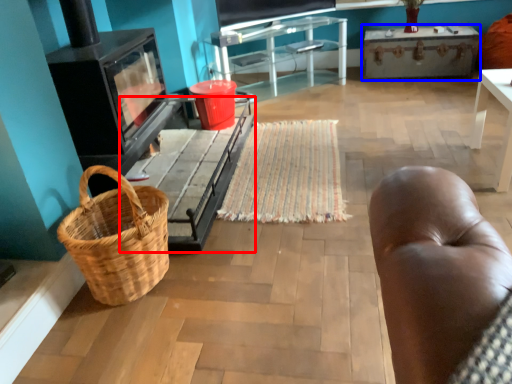
Question: Among these objects, which one is nearest to the camera, table (highlighted by a red box) or table (highlighted by a blue box)?

Choices:
 (A) table
 (B) table

Answer: (A)